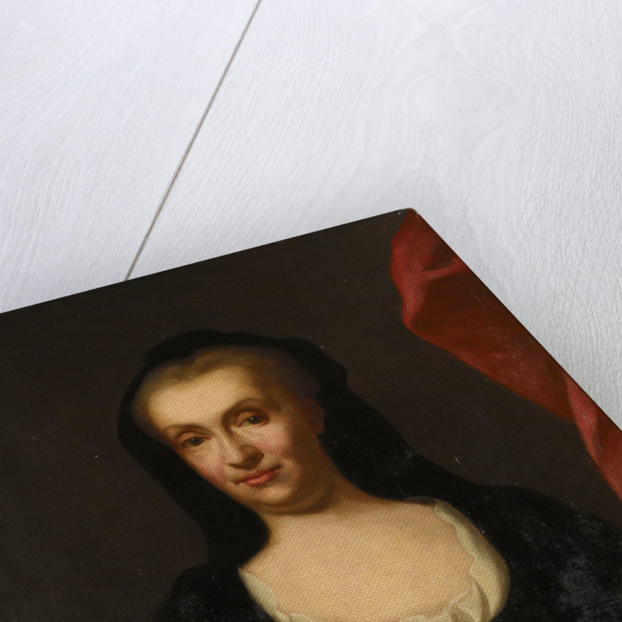
Where is `painted picture`? Image resolution: width=622 pixels, height=622 pixels. painted picture is located at coordinates (348, 360).